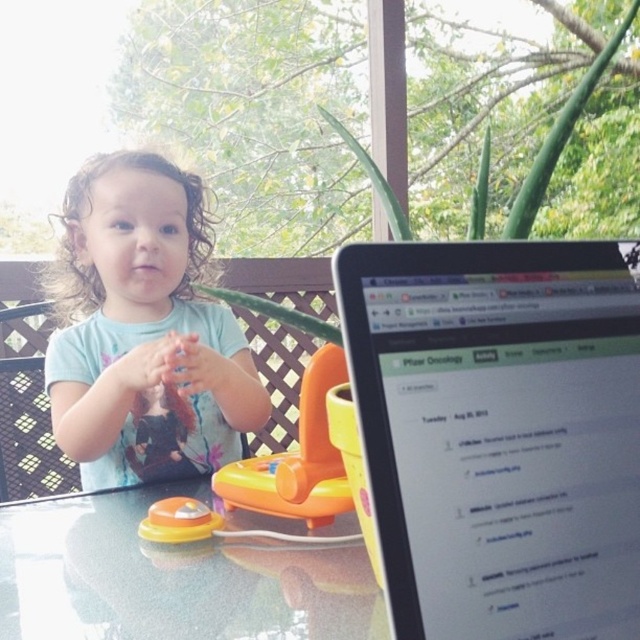
You are a parent trying to place a small snack on the table without disturbing the child. The snack is 3 inches wide. Can you place it on the glossy plastic table at center while keeping it at least 1 inch away from the translucent orange toy at center?

The distance between the glossy plastic table at center and the translucent orange toy at center is 4.25 inches. Since the snack is 3 inches wide and needs to be at least 1 inch away from the toy, there is sufficient space. The snack can be placed on the glossy plastic table at center as the total required space is 4 inches, which is less than the available 4.25 inches.

You are a photographer trying to capture a closeup shot of the toddler while ensuring the table is still visible in the frame. Given the sizes of the light blue cotton toddler at center and the glossy plastic table at center, which object should you focus on to include both in the shot?

The light blue cotton toddler at center is larger in size than the glossy plastic table at center. To include both in the shot, focus on the toddler since it is larger and occupies more space, allowing the table to remain visible in the background.